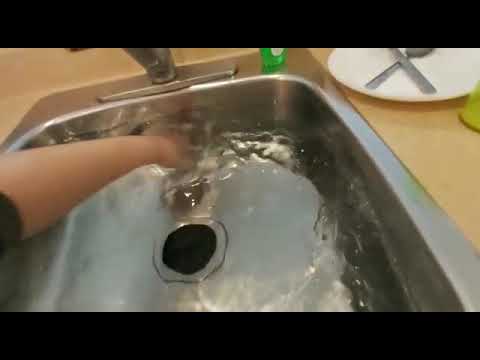
Locate an element on the screen. The image size is (480, 360). sink is located at coordinates (193, 253).